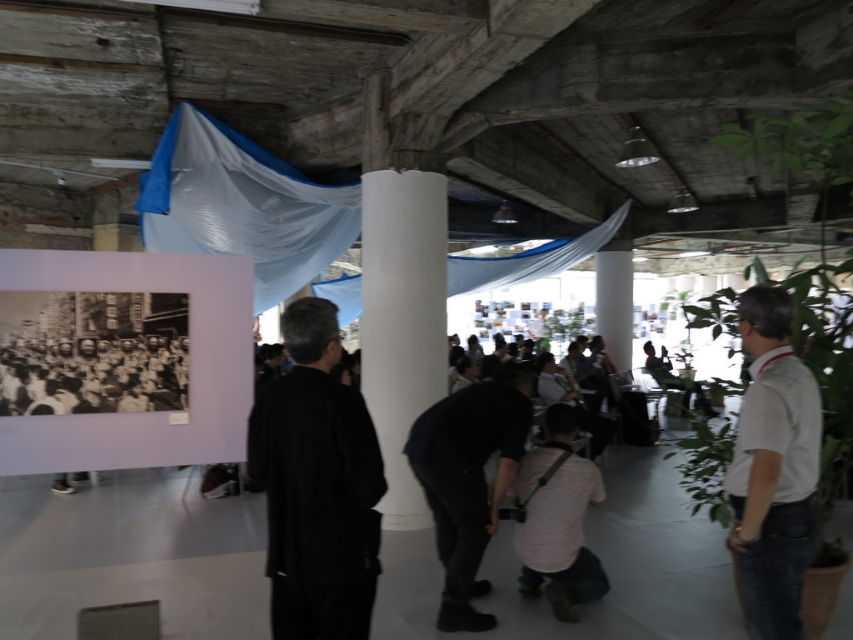
How distant is black matte jacket at center from white cotton shirt at right?

black matte jacket at center is 1.15 meters from white cotton shirt at right.

Locate an element on the screen. Image resolution: width=853 pixels, height=640 pixels. black matte jacket at center is located at coordinates (316, 484).

Locate an element on the screen. This screenshot has width=853, height=640. black matte jacket at center is located at coordinates (316, 484).

Describe the element at coordinates (772, 468) in the screenshot. I see `white cotton shirt at right` at that location.

Does white cotton shirt at right appear on the right side of black matte shirt at center?

Indeed, white cotton shirt at right is positioned on the right side of black matte shirt at center.

The image size is (853, 640). Find the location of `white cotton shirt at right`. white cotton shirt at right is located at coordinates (772, 468).

Who is taller, black matte jacket at center or black matte shirt at center?

black matte shirt at center is taller.

Between point (314, 452) and point (479, 548), which one is positioned in front?

Point (314, 452) is in front.

The height and width of the screenshot is (640, 853). In order to click on black matte jacket at center in this screenshot , I will do `click(316, 484)`.